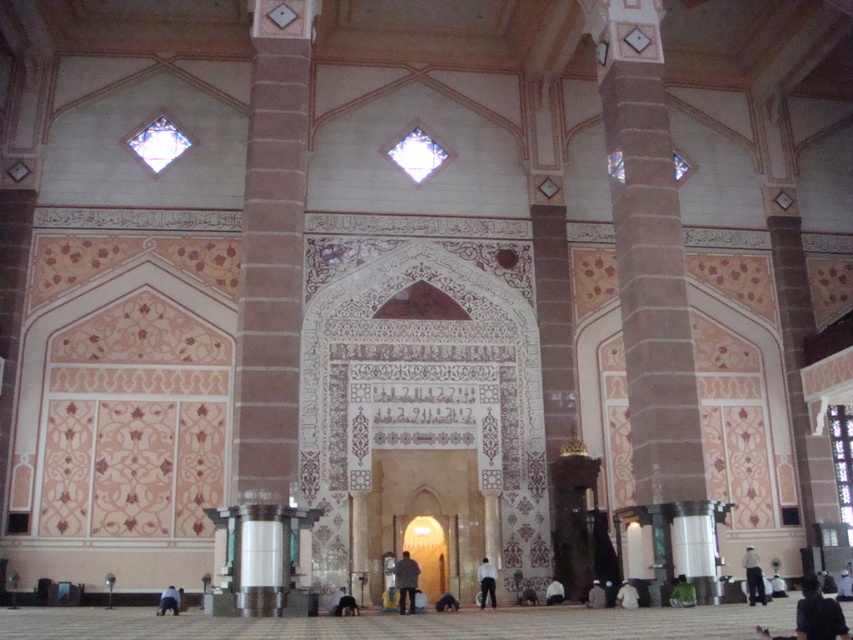
Question: Among these objects, which one is nearest to the camera?

Choices:
 (A) white fabric at center
 (B) dark gray fabric at lower center
 (C) dark brown leather shoes at lower center

Answer: (B)

Question: Does brown stone pillar at center appear on the left side of dark brown leather shoes at lower center?

Choices:
 (A) yes
 (B) no

Answer: (B)

Question: Can you confirm if white cotton person at lower right is positioned to the right of dark gray fabric at lower center?

Choices:
 (A) yes
 (B) no

Answer: (A)

Question: Which point is farther to the camera?

Choices:
 (A) (169, 589)
 (B) (554, 589)

Answer: (B)

Question: Based on their relative distances, which object is farther from the white cotton person at lower right?

Choices:
 (A) dark gray fabric person at center
 (B) dark gray fabric at lower center

Answer: (A)

Question: Is white cotton person at lower right positioned in front of green fabric at lower center?

Choices:
 (A) yes
 (B) no

Answer: (B)